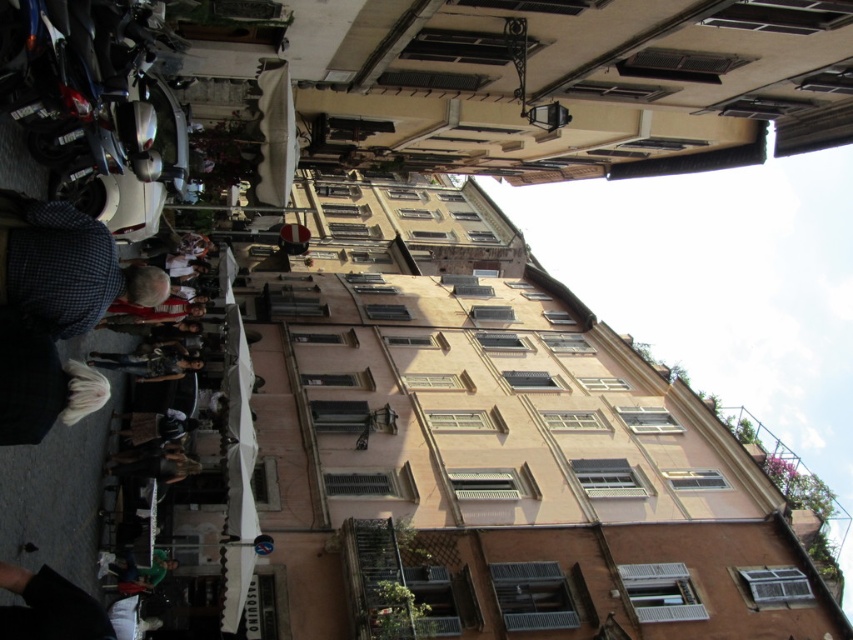
Question: Considering the relative positions of checkered fabric shirt at left and green fabric shirt at lower left in the image provided, where is checkered fabric shirt at left located with respect to green fabric shirt at lower left?

Choices:
 (A) above
 (B) below

Answer: (A)

Question: Which object appears closest to the camera in this image?

Choices:
 (A) green fabric shirt at lower left
 (B) checkered fabric shirt at left

Answer: (B)

Question: Considering the relative positions of checkered fabric shirt at left and green fabric shirt at lower left in the image provided, where is checkered fabric shirt at left located with respect to green fabric shirt at lower left?

Choices:
 (A) right
 (B) left

Answer: (A)

Question: Does checkered fabric shirt at left appear on the right side of green fabric shirt at lower left?

Choices:
 (A) no
 (B) yes

Answer: (B)

Question: Which point is closer to the camera?

Choices:
 (A) checkered fabric shirt at left
 (B) green fabric shirt at lower left

Answer: (A)